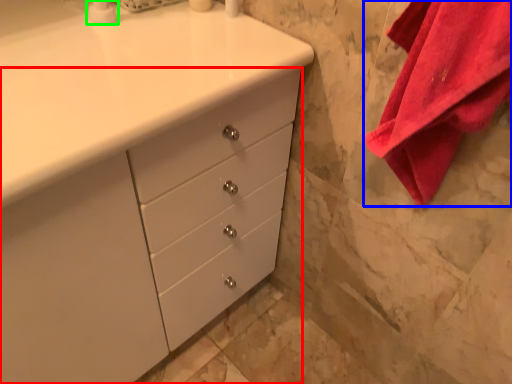
Question: Which object is positioned closest to chest of drawers (highlighted by a red box)? Select from bath towel (highlighted by a blue box) and soap dispenser (highlighted by a green box).

Choices:
 (A) bath towel
 (B) soap dispenser

Answer: (A)